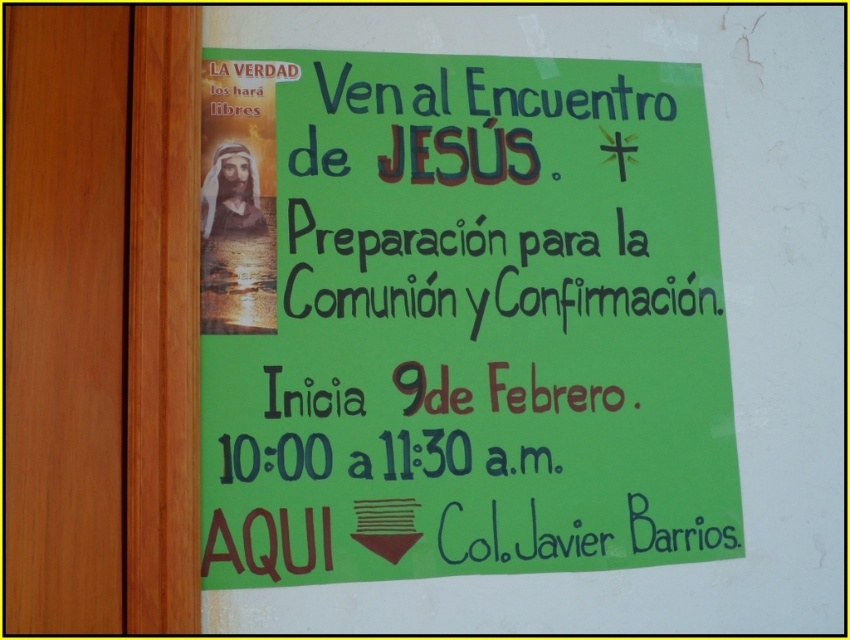
What does the point at coordinates (459, 317) indicate on the image?

The point at coordinates (459, 317) marks the green paper poster at upper center.

You are standing in a hallway and see the green paper poster at upper center and the brown wood door at left. Which object is located more to the right side of the hallway?

The green paper poster at upper center is more to the right side of the hallway because it is positioned on the right side of the brown wood door at left.

You are standing in a hallway and see the green paper poster at upper center and the brown wood door at left. Which object is closer to you?

The brown wood door at left is behind the green paper poster at upper center, so the green paper poster at upper center is closer to you.